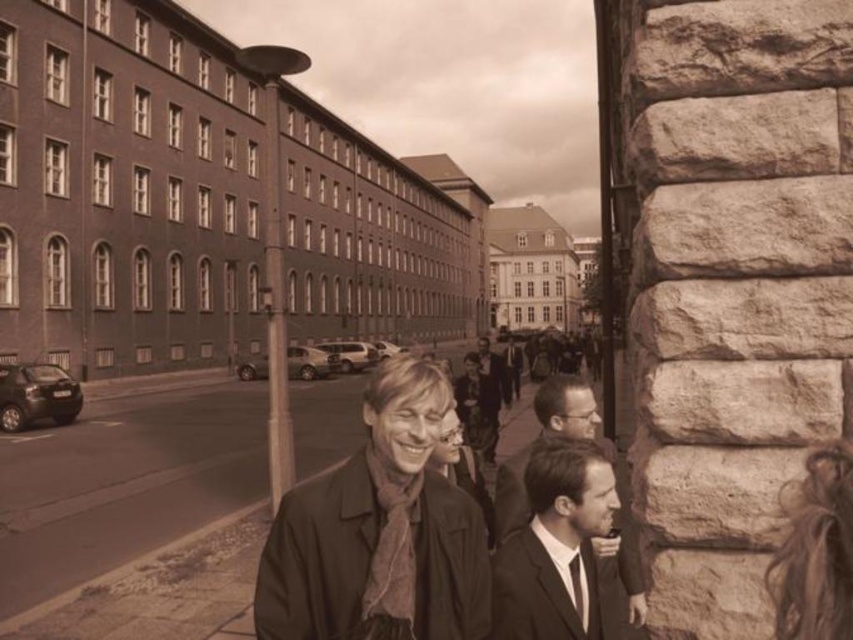
Question: Which point is farther from the camera taking this photo?

Choices:
 (A) (570, 566)
 (B) (535, 406)

Answer: (B)

Question: Based on their relative distances, which object is nearer to the smooth black suit at center?

Choices:
 (A) dark brown leather jacket at center
 (B) silky black tie at lower center

Answer: (A)

Question: Considering the real-world distances, which object is closest to the dark brown leather jacket at center?

Choices:
 (A) silky black tie at lower center
 (B) smooth black suit at center

Answer: (A)

Question: Is the position of smooth black suit at center more distant than that of silky black tie at lower center?

Choices:
 (A) no
 (B) yes

Answer: (B)

Question: Where is dark brown leather jacket at center located in relation to smooth black suit at center in the image?

Choices:
 (A) right
 (B) left

Answer: (B)

Question: Does smooth black suit at center have a smaller size compared to silky black tie at lower center?

Choices:
 (A) no
 (B) yes

Answer: (A)